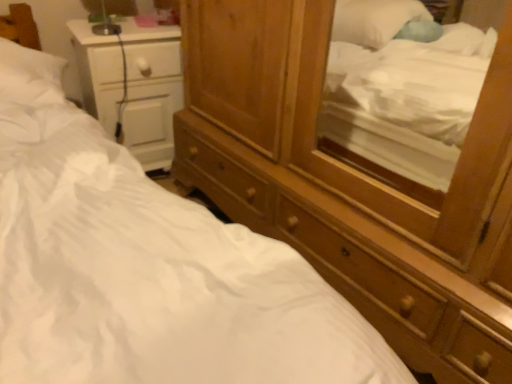
Question: Is wooden dresser at center positioned beyond the bounds of white glossy nightstand at left?

Choices:
 (A) yes
 (B) no

Answer: (A)

Question: Is wooden dresser at center to the right of white glossy nightstand at left from the viewer's perspective?

Choices:
 (A) no
 (B) yes

Answer: (B)

Question: Could you tell me if wooden dresser at center is facing white glossy nightstand at left?

Choices:
 (A) no
 (B) yes

Answer: (A)

Question: Is white glossy nightstand at left inside wooden dresser at center?

Choices:
 (A) no
 (B) yes

Answer: (A)

Question: From a real-world perspective, is wooden dresser at center over white glossy nightstand at left?

Choices:
 (A) yes
 (B) no

Answer: (A)

Question: Can you confirm if wooden dresser at center is thinner than white glossy nightstand at left?

Choices:
 (A) no
 (B) yes

Answer: (A)

Question: Does white glossy nightstand at left appear on the left side of wooden dresser at center?

Choices:
 (A) yes
 (B) no

Answer: (A)

Question: Is white glossy nightstand at left facing away from wooden dresser at center?

Choices:
 (A) no
 (B) yes

Answer: (A)

Question: Is white glossy nightstand at left far away from wooden dresser at center?

Choices:
 (A) yes
 (B) no

Answer: (B)

Question: From a real-world perspective, is white glossy nightstand at left on top of wooden dresser at center?

Choices:
 (A) yes
 (B) no

Answer: (B)

Question: From a real-world perspective, is white glossy nightstand at left physically below wooden dresser at center?

Choices:
 (A) yes
 (B) no

Answer: (A)

Question: Does white glossy nightstand at left lie in front of wooden dresser at center?

Choices:
 (A) yes
 (B) no

Answer: (B)

Question: From the image's perspective, is wooden dresser at center positioned above or below white glossy nightstand at left?

Choices:
 (A) above
 (B) below

Answer: (B)